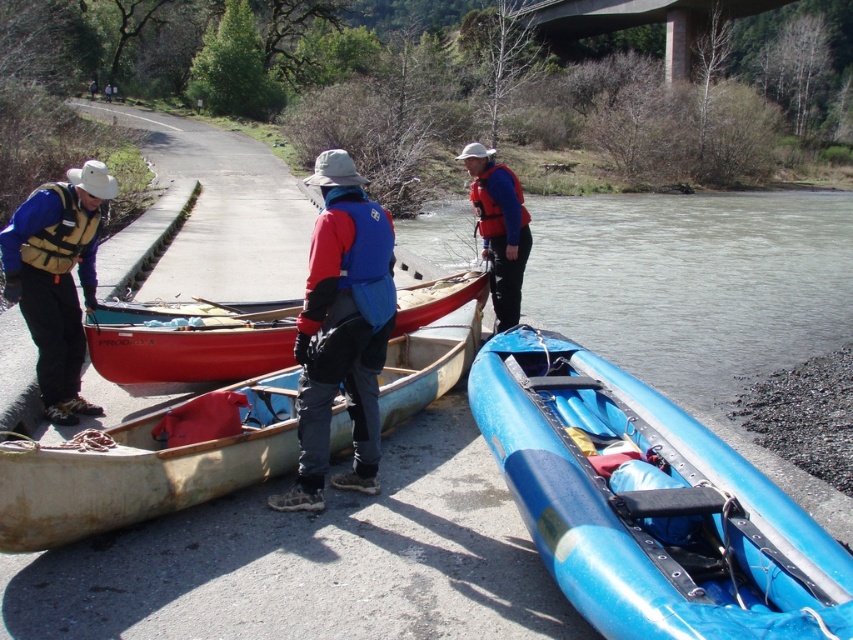
Does blue rubber boat at lower right have a lesser width compared to red fabric jacket at center?

No.

Is point (718, 461) behind point (312, 481)?

No, (718, 461) is closer to viewer.

Locate an element on the screen. blue rubber boat at lower right is located at coordinates tap(648, 504).

Is matte blue life vest at center further to camera compared to matte blue life jacket at center?

No, it is in front of matte blue life jacket at center.

Is matte blue life vest at center below matte blue life jacket at center?

Indeed, matte blue life vest at center is positioned under matte blue life jacket at center.

The width and height of the screenshot is (853, 640). Find the location of `matte blue life vest at center`. matte blue life vest at center is located at coordinates (498, 228).

Can you confirm if matte red canoe at center is taller than matte blue life vest at center?

No.

Find the location of a particular element. matte red canoe at center is located at coordinates (189, 340).

The height and width of the screenshot is (640, 853). What are the coordinates of `matte red canoe at center` in the screenshot? It's located at (189, 340).